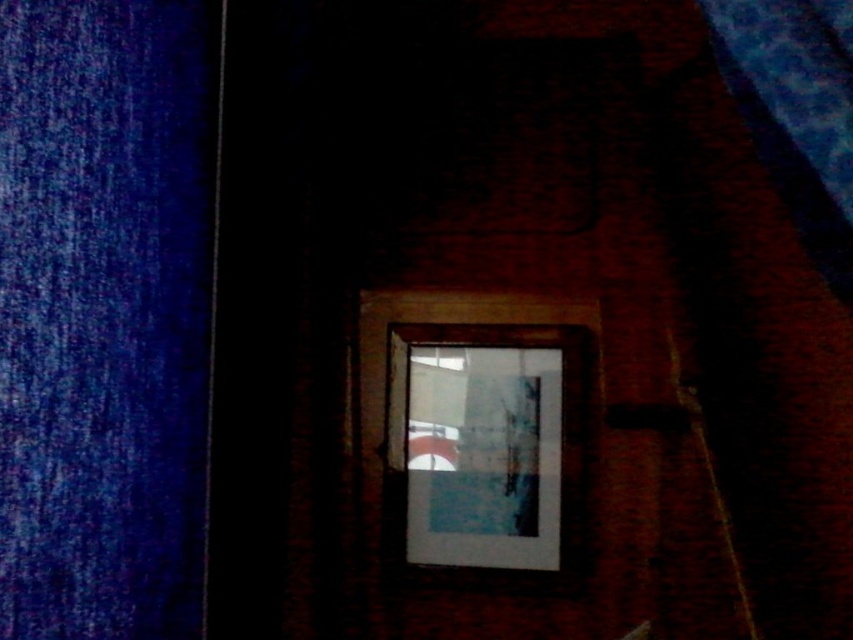
Question: Can you confirm if blue fabric curtain at left is positioned to the right of blue fabric curtain at upper right?

Choices:
 (A) no
 (B) yes

Answer: (A)

Question: Among these objects, which one is farthest from the camera?

Choices:
 (A) blue fabric curtain at upper right
 (B) wooden picture frame at center

Answer: (B)

Question: Among these objects, which one is farthest from the camera?

Choices:
 (A) blue fabric curtain at upper right
 (B) blue fabric curtain at left
 (C) wooden picture frame at center

Answer: (C)

Question: Does wooden picture frame at center have a greater width compared to blue fabric curtain at upper right?

Choices:
 (A) no
 (B) yes

Answer: (B)

Question: Which point is closer to the camera taking this photo?

Choices:
 (A) (193, 109)
 (B) (772, 170)

Answer: (A)

Question: Is wooden picture frame at center bigger than blue fabric curtain at upper right?

Choices:
 (A) no
 (B) yes

Answer: (A)